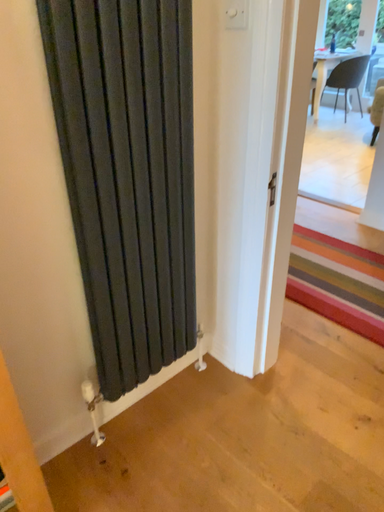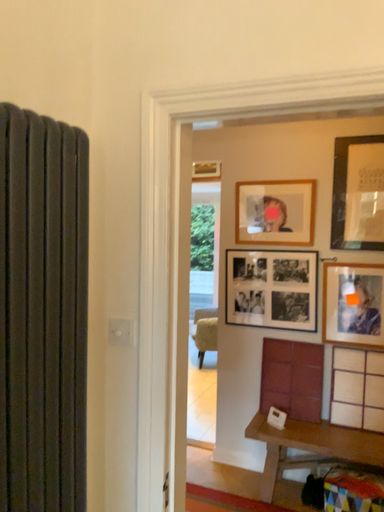
Question: How did the camera likely rotate when shooting the video?

Choices:
 (A) rotated upward
 (B) rotated downward

Answer: (A)